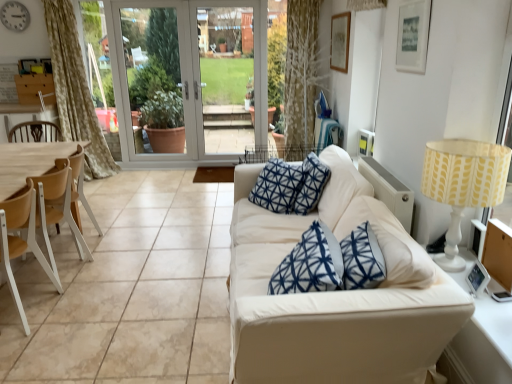
Question: Considering the relative positions of matte white picture frame at upper right and yellow fabric lampshade at right in the image provided, is matte white picture frame at upper right to the left or to the right of yellow fabric lampshade at right?

Choices:
 (A) left
 (B) right

Answer: (A)

Question: Is matte white picture frame at upper right wider or thinner than yellow fabric lampshade at right?

Choices:
 (A) thin
 (B) wide

Answer: (A)

Question: Which of these objects is positioned farthest from the light brown wood armchair at left?

Choices:
 (A) white fabric couch at center
 (B) light wood/woodenchair at left, arranged as the 1th chair when viewed from the back
 (C) wooden at left, arranged as the first chair when viewed from the front
 (D) matte white picture frame at upper right
 (E) white glass screen door at center, positioned as the first screen door in left-to-right order

Answer: (E)

Question: Which of these objects is positioned closest to the matte white picture frame at upper right?

Choices:
 (A) clear glass door at center, which is the second screen door from left to right
 (B) yellow fabric lampshade at right
 (C) white glass screen door at center, positioned as the first screen door in left-to-right order
 (D) wooden at left, the second chair in the back-to-front sequence
 (E) silver metallic clock at upper left

Answer: (B)